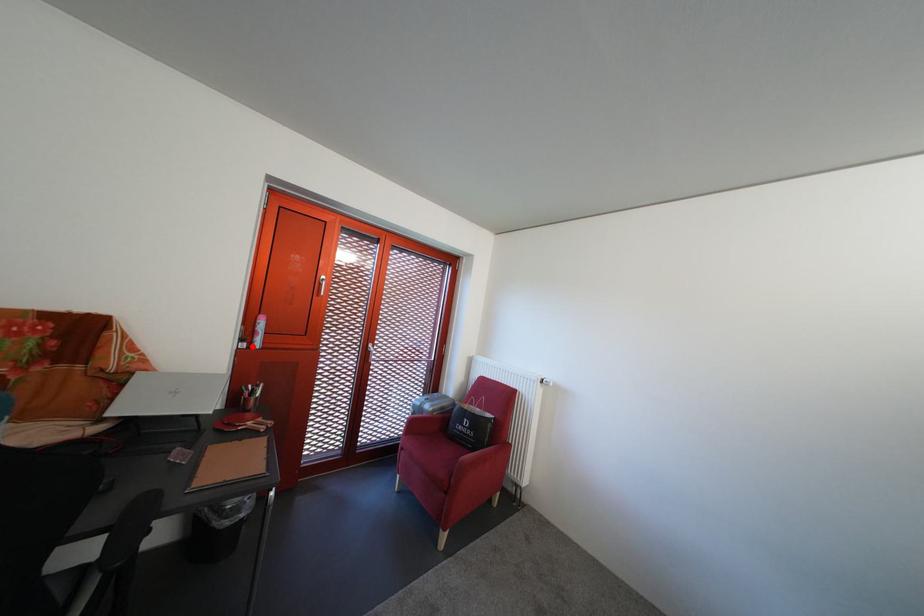
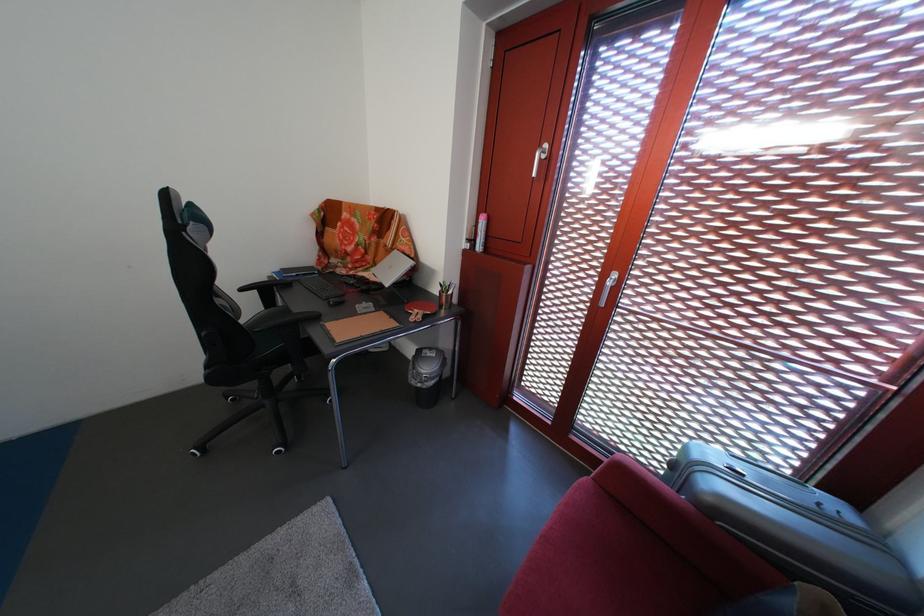
In the second image, find the point that corresponds to the highlighted location in the first image.

(479, 246)